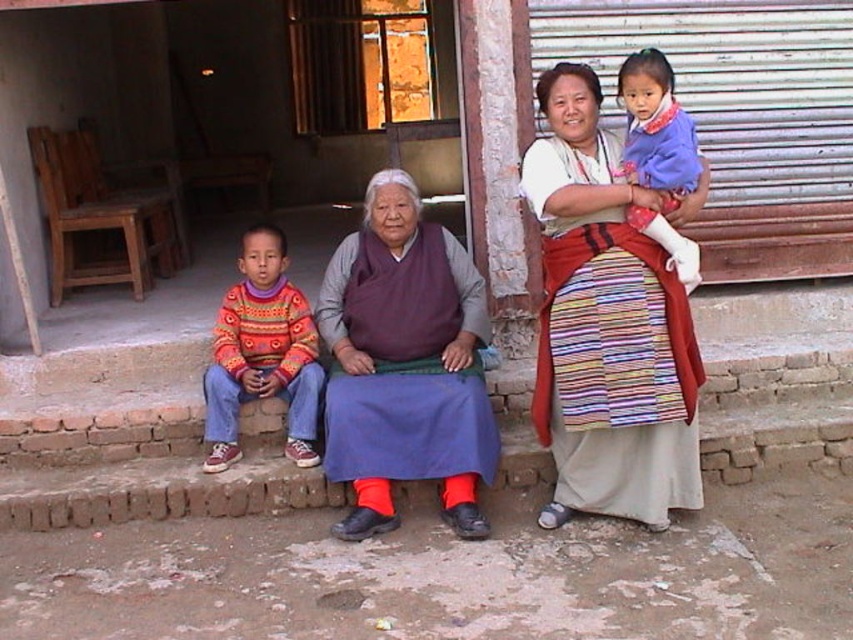
Question: Is multicolored woven cloth at center to the left of purple woolen robe at center from the viewer's perspective?

Choices:
 (A) no
 (B) yes

Answer: (A)

Question: Can you confirm if purple woolen robe at center is smaller than blue fabric baby at center?

Choices:
 (A) no
 (B) yes

Answer: (A)

Question: Which point is farther from the camera taking this photo?

Choices:
 (A) (254, 269)
 (B) (554, 515)
 (C) (688, 132)
 (D) (339, 353)

Answer: (A)

Question: Which of the following is the farthest from the observer?

Choices:
 (A) (654, 253)
 (B) (598, 173)
 (C) (694, 180)
 (D) (218, 449)

Answer: (D)

Question: Is multicolored woven cloth at center thinner than purple woolen vest at center?

Choices:
 (A) no
 (B) yes

Answer: (B)

Question: Which object is positioned closest to the multicolored woven cloth at center?

Choices:
 (A) blue fabric baby at center
 (B) purple woolen robe at center
 (C) knitted wool sweater at left

Answer: (B)